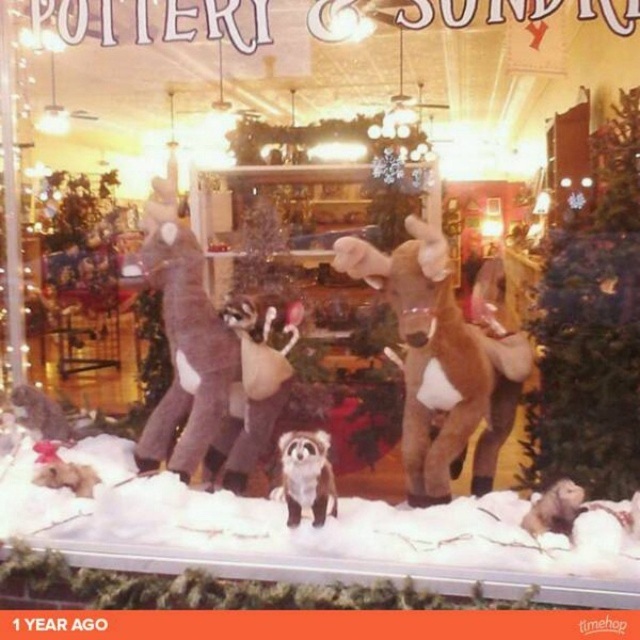
Can you confirm if white fluffy snow at center is thinner than fuzzy brown raccoon at center?

In fact, white fluffy snow at center might be wider than fuzzy brown raccoon at center.

The image size is (640, 640). What do you see at coordinates (316, 536) in the screenshot?
I see `white fluffy snow at center` at bounding box center [316, 536].

Locate an element on the screen. The width and height of the screenshot is (640, 640). white fluffy snow at center is located at coordinates (316, 536).

Does brown plush reindeer at center have a lesser width compared to fuzzy brown raccoon at center?

No.

Is brown plush reindeer at center wider than fuzzy brown raccoon at center?

Yes, brown plush reindeer at center is wider than fuzzy brown raccoon at center.

Find the location of a particular element. The width and height of the screenshot is (640, 640). brown plush reindeer at center is located at coordinates (440, 362).

Between brown plush reindeer at center and fuzzy brown raccoon at lower right, which one appears on the left side from the viewer's perspective?

brown plush reindeer at center

Can you confirm if brown plush reindeer at center is positioned to the left of fuzzy brown raccoon at lower right?

Indeed, brown plush reindeer at center is positioned on the left side of fuzzy brown raccoon at lower right.

Where is `brown plush reindeer at center`? This screenshot has width=640, height=640. brown plush reindeer at center is located at coordinates [x=440, y=362].